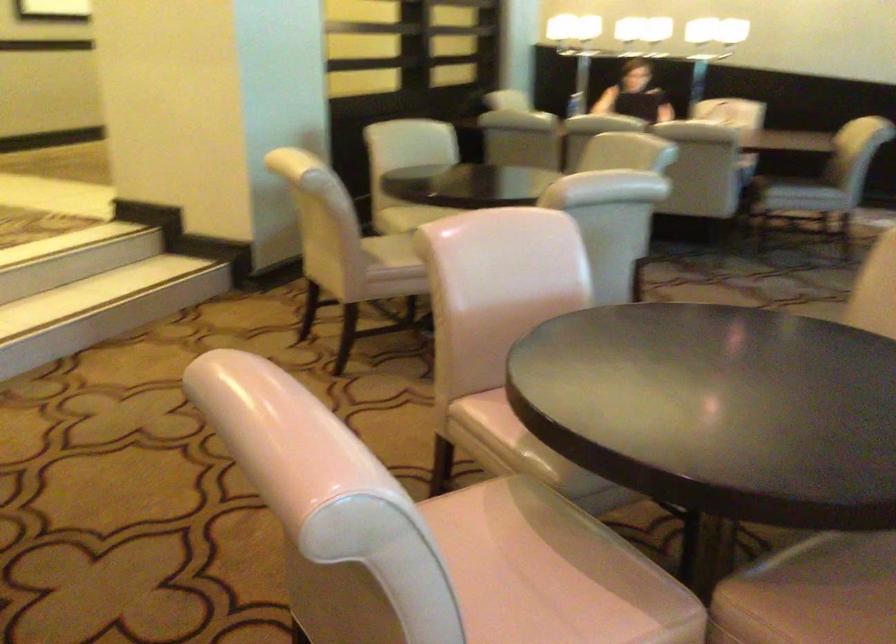
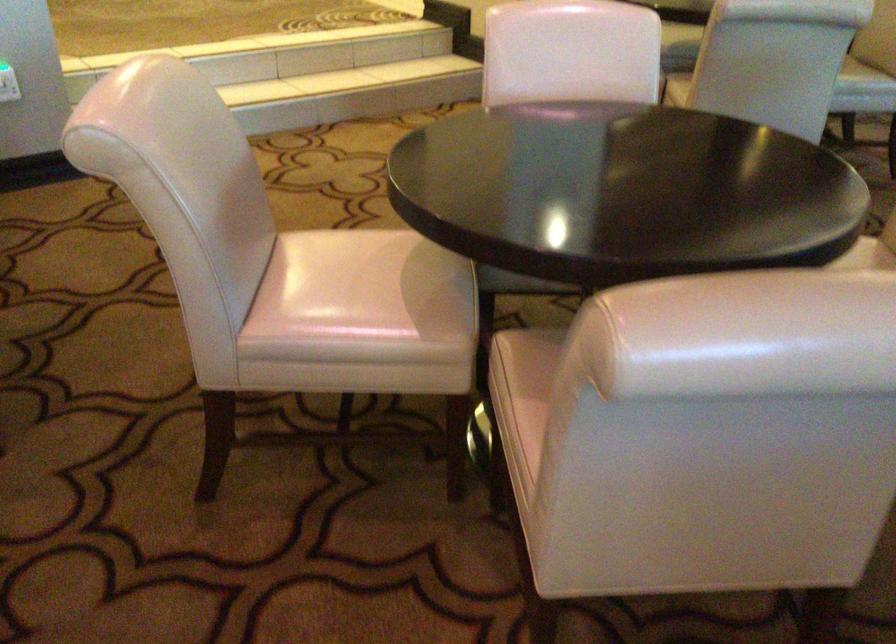
Find the pixel in the second image that matches (494,570) in the first image.

(347, 278)